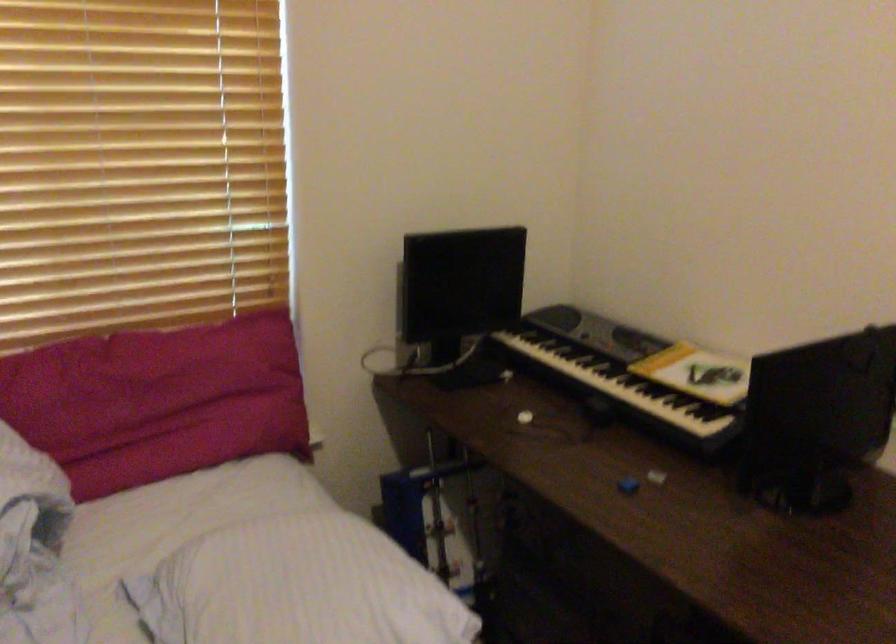
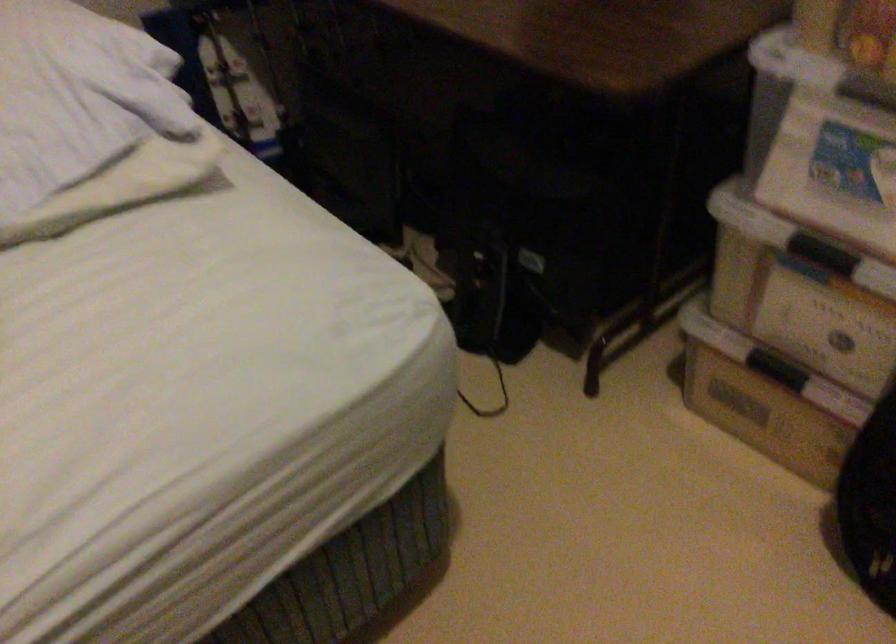
Question: Based on the continuous images, in which direction is the camera rotating? Reply with the corresponding letter.

Choices:
 (A) Left
 (B) Right
 (C) Up
 (D) Down

Answer: (D)